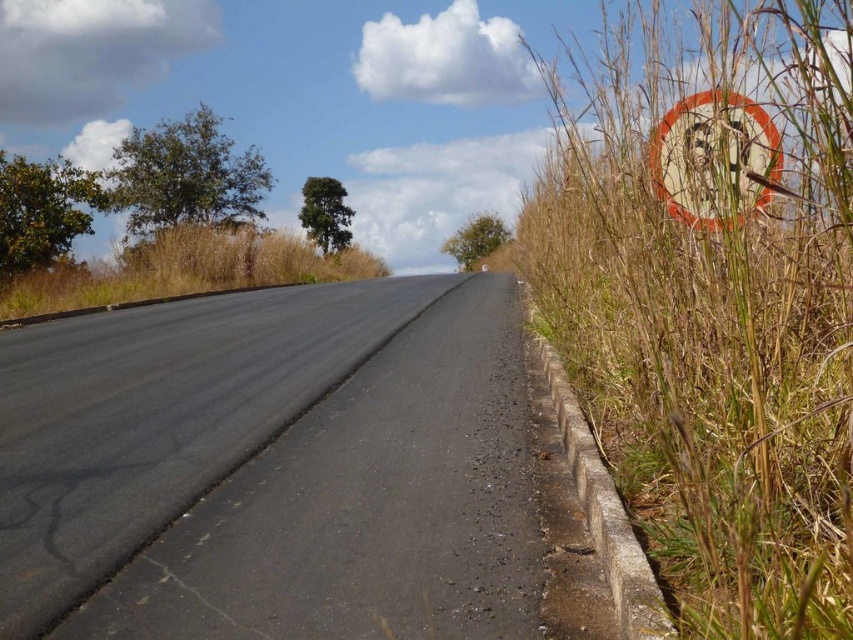
Question: Can you confirm if dry grass at left is wider than white plastic speed limit sign at right?

Choices:
 (A) yes
 (B) no

Answer: (A)

Question: Is brown dry grass at right positioned before white plastic speed limit sign at right?

Choices:
 (A) yes
 (B) no

Answer: (A)

Question: Which point is closer to the camera taking this photo?

Choices:
 (A) (761, 125)
 (B) (816, 516)
 (C) (285, 250)

Answer: (B)

Question: Which point appears farthest from the camera in this image?

Choices:
 (A) (677, 468)
 (B) (276, 236)

Answer: (B)

Question: Where is brown dry grass at right located in relation to dry grass at left in the image?

Choices:
 (A) right
 (B) left

Answer: (A)

Question: Which object appears farthest from the camera in this image?

Choices:
 (A) dry grass at left
 (B) brown dry grass at right

Answer: (A)